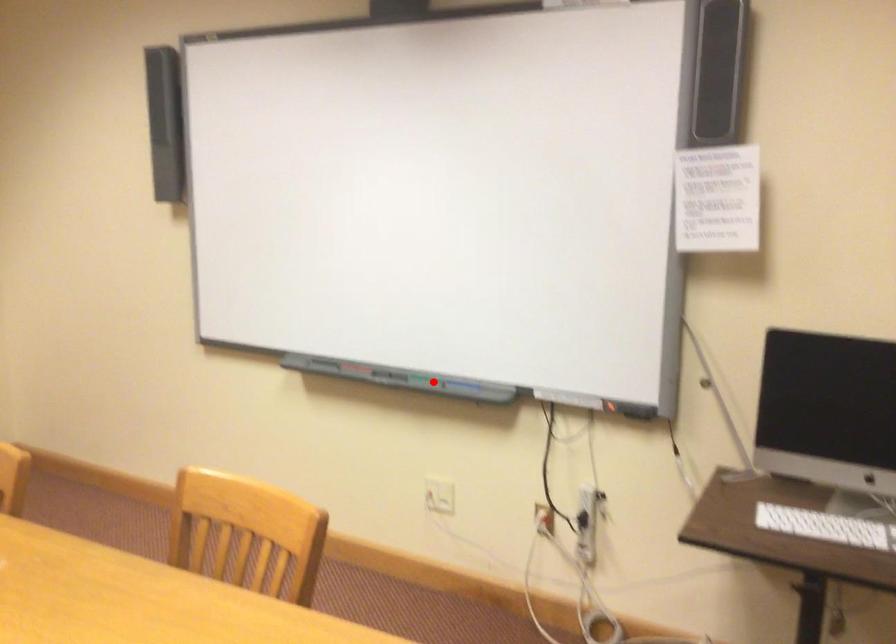
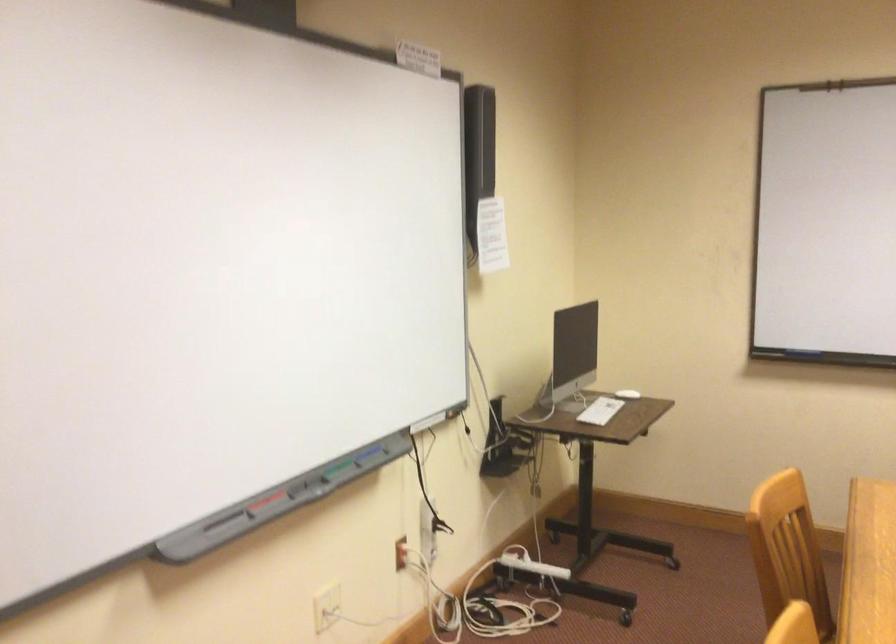
Question: I am providing you with two images of the same scene from different viewpoints. Given a red point in image1, look at the same physical point in image2. Is it:

Choices:
 (A) Closer to the viewpoint
 (B) Farther from the viewpoint

Answer: (A)